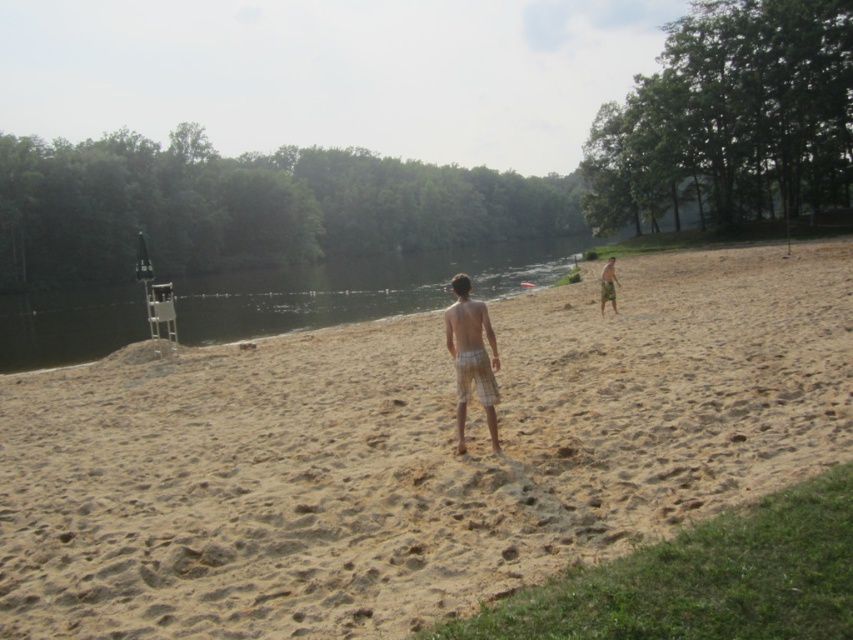
Looking at this image, you are a photographer standing on the beach and want to capture a photo of the clear water at center and the beige plaid shorts at center. Based on their positions, which object is closer to the camera?

The clear water at center is located above the beige plaid shorts at center, meaning the clear water at center is closer to the camera.

You are a photographer standing on the beach. You want to take a photo that includes both the clear water at center and the white plaid shorts at center. Which object should you zoom in on to ensure both are in the frame?

The clear water at center is bigger than the white plaid shorts at center, so you should zoom in on the white plaid shorts at center to ensure both are in the frame.